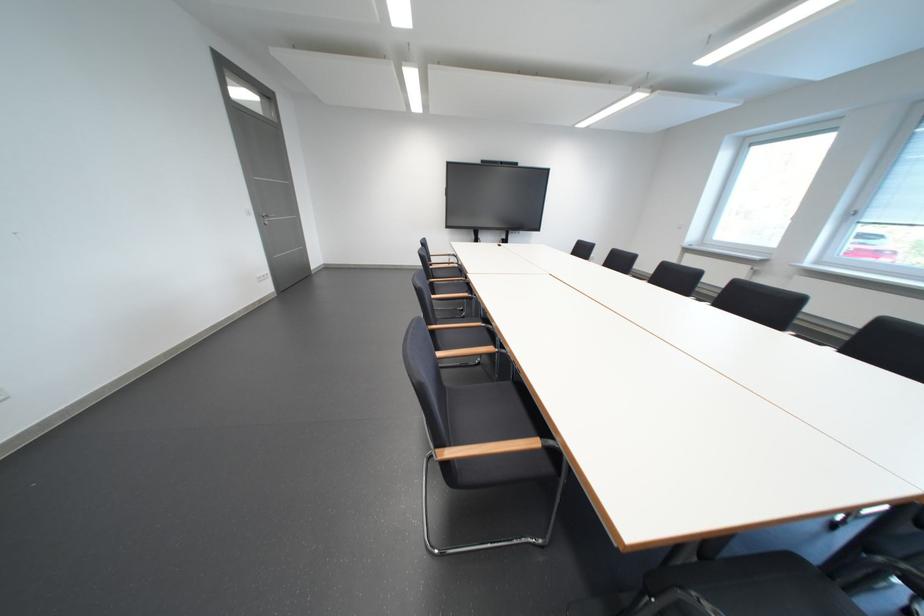
This screenshot has height=616, width=924. What are the coordinates of `silver door handle` in the screenshot? It's located at [268, 216].